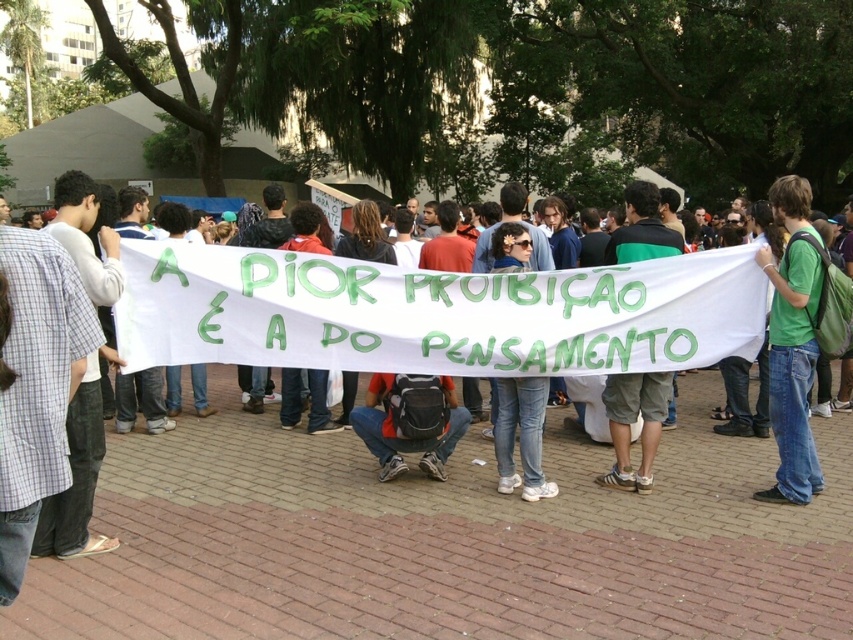
From the picture: What is the exact coordinate of the white fabric banner at center?

The white fabric banner at center is located at point (463,480).